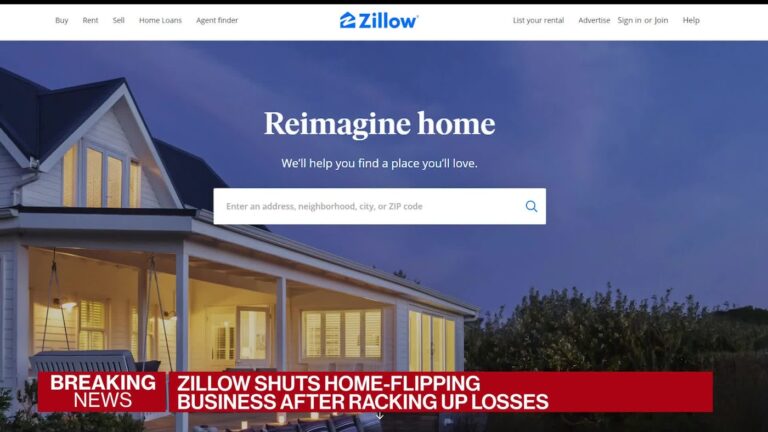
Identify the location of short plant behind swing. (17, 418).